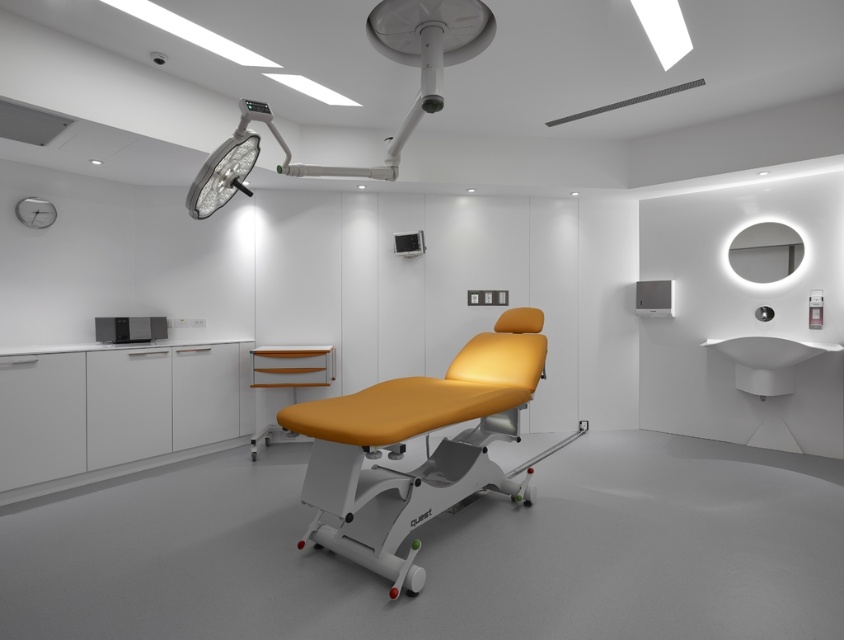
Is matte white surgical light at upper center shorter than matte black monitor at lower left?

No.

Does matte white surgical light at upper center have a larger size compared to matte black monitor at lower left?

Indeed, matte white surgical light at upper center has a larger size compared to matte black monitor at lower left.

Identify the location of matte white surgical light at upper center. (383, 54).

Identify the location of matte white surgical light at upper center. This screenshot has width=844, height=640. (383, 54).

Who is shorter, matte orange leather chair at center or matte black monitor at lower left?

With less height is matte black monitor at lower left.

The width and height of the screenshot is (844, 640). What are the coordinates of `matte orange leather chair at center` in the screenshot? It's located at (425, 445).

Does matte orange leather chair at center appear on the left side of matte white surgical light at upper center?

Incorrect, matte orange leather chair at center is not on the left side of matte white surgical light at upper center.

Is matte orange leather chair at center positioned before matte white surgical light at upper center?

Yes, matte orange leather chair at center is in front of matte white surgical light at upper center.

Between point (463, 353) and point (312, 173), which one is positioned behind?

The point (463, 353) is more distant.

Find the location of a particular element. This screenshot has width=844, height=640. matte orange leather chair at center is located at coordinates (425, 445).